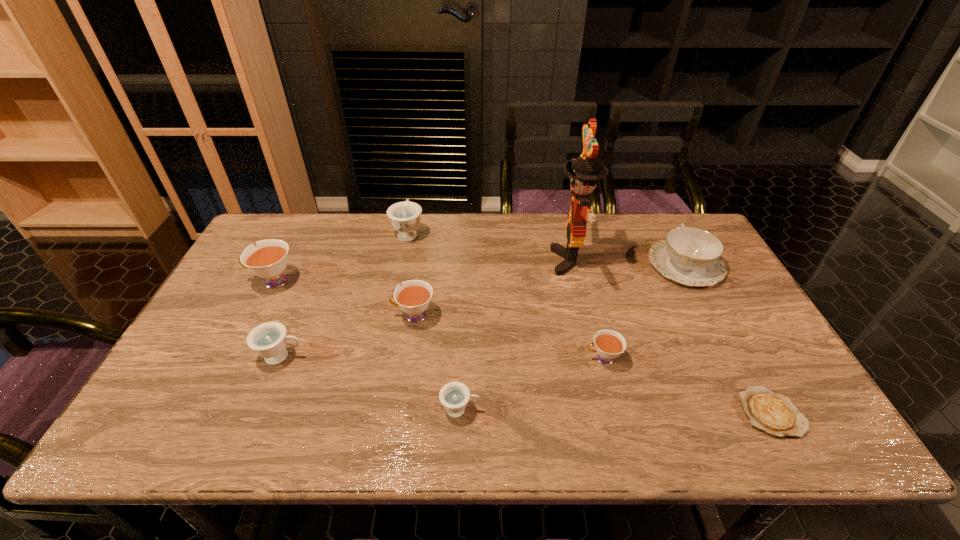
Locate an element on the screen. nutcracker is located at coordinates (584, 171).

Locate an element on the screen. Image resolution: width=960 pixels, height=540 pixels. the leftmost white teacup is located at coordinates (269, 259).

You are a GUI agent. You are given a task and a screenshot of the screen. Output one action in this format:
    pyautogui.click(x=<x>, y=<y>)
    Task: Click on the farthest white teacup
    The image size is (960, 540).
    Given the screenshot: What is the action you would take?
    pyautogui.click(x=269, y=259)

This screenshot has width=960, height=540. I want to click on the farthest blue teacup, so click(x=405, y=216).

You are a GUI agent. You are given a task and a screenshot of the screen. Output one action in this format:
    pyautogui.click(x=<x>, y=<y>)
    Task: Click on the second blue teacup from left to right
    The height and width of the screenshot is (540, 960).
    Given the screenshot: What is the action you would take?
    pyautogui.click(x=405, y=216)

Identify the location of blue chinaware. The image size is (960, 540). (690, 256).

Find the location of a particular element. the second smallest white teacup is located at coordinates (414, 296).

Where is `the second white teacup from left to right`? The height and width of the screenshot is (540, 960). the second white teacup from left to right is located at coordinates (414, 296).

Locate an element on the screen. The height and width of the screenshot is (540, 960). the second smallest blue teacup is located at coordinates click(269, 340).

Where is `the leftmost blue teacup`? The width and height of the screenshot is (960, 540). the leftmost blue teacup is located at coordinates (269, 340).